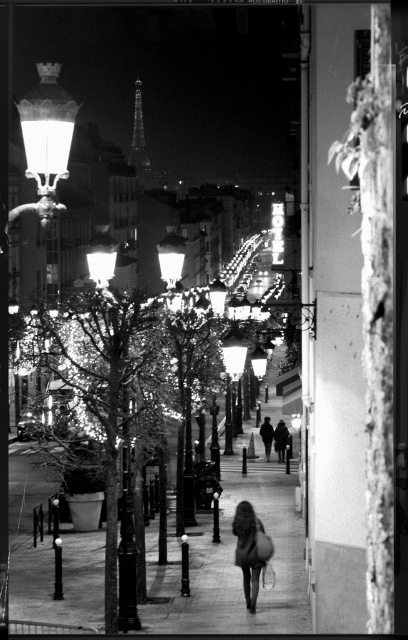
You are standing on a balcony overlooking the street in Paris. You notice two points in the scene. The first point is at coordinates point (152, 576) and the second point is at coordinates point (133, 161). Which point is closer to you?

Point (152, 576) is closer to the camera than point (133, 161).

You are standing on the balcony and want to take a photo of the smooth concrete sidewalk at center. According to the scene description, where should you point your camera to capture it accurately?

You should point your camera to the center of the image where the smooth concrete sidewalk at center is located, as its 2D coordinates are at point (232,563).